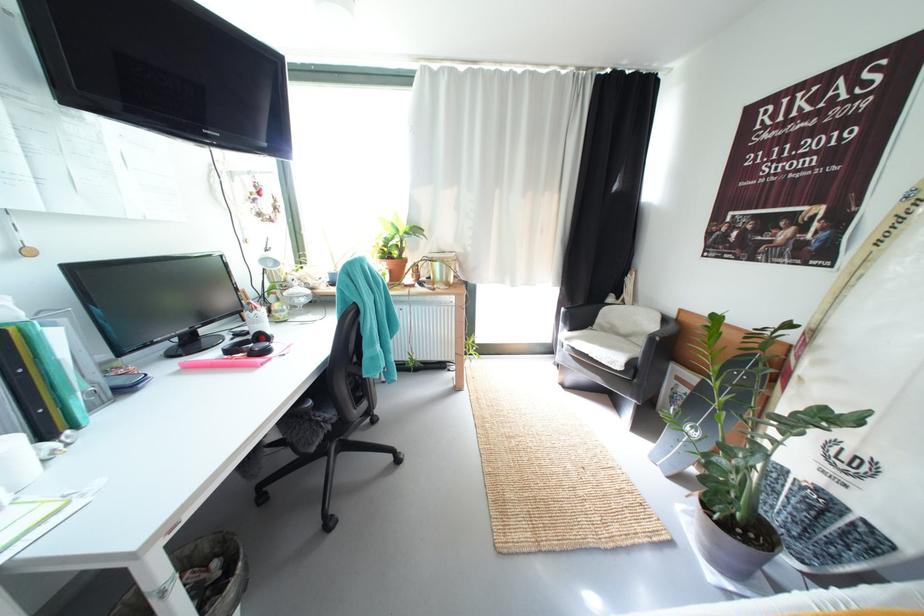
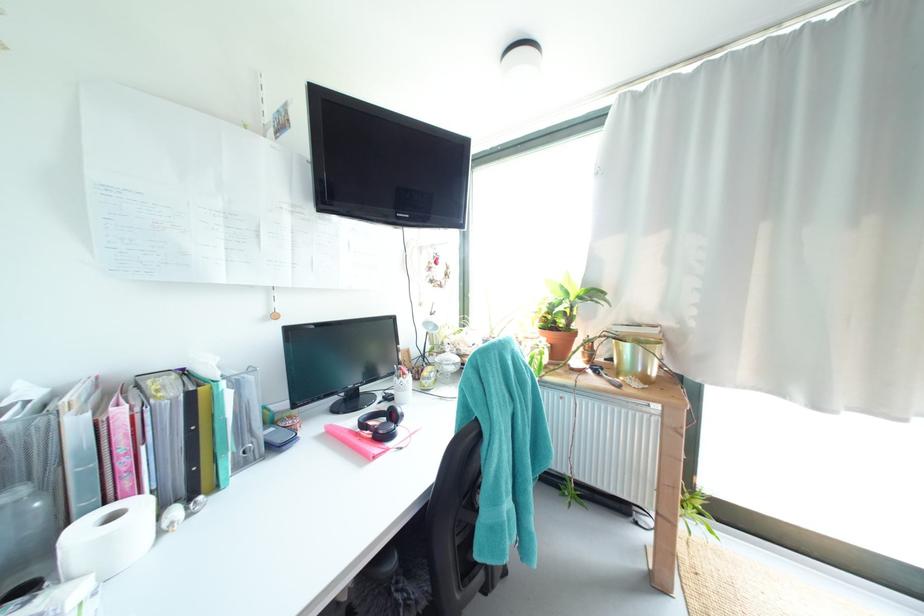
Locate, in the second image, the point that corresponds to point (294, 296) in the first image.

(445, 361)